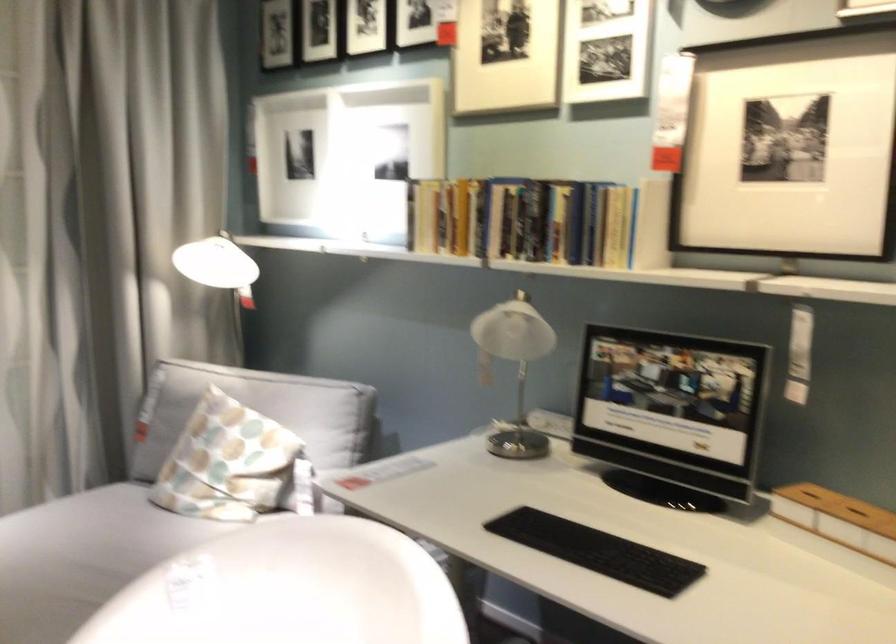
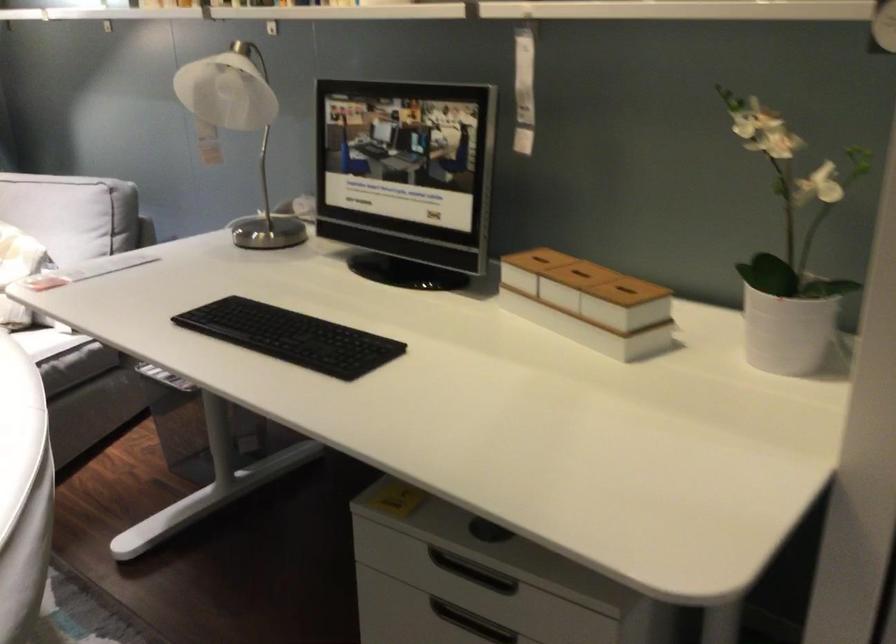
Question: Based on the continuous images, in which direction is the camera rotating? Reply with the corresponding letter.

Choices:
 (A) Left
 (B) Right
 (C) Up
 (D) Down

Answer: (D)